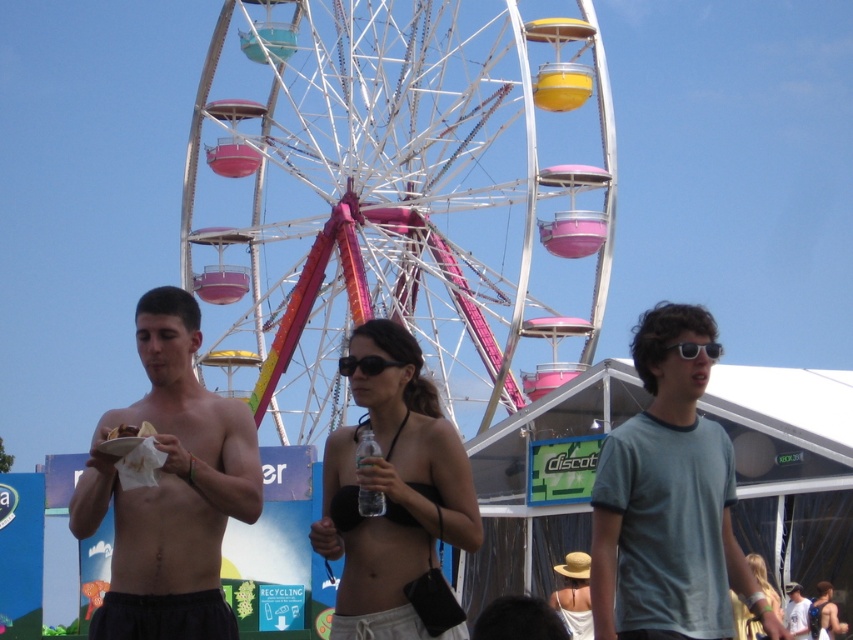
Does metallic ferris wheel at center appear under white cotton t-shirt at center?

No.

Is metallic ferris wheel at center smaller than white cotton t-shirt at center?

No.

Who is more forward, (334, 305) or (795, 596)?

Positioned in front is point (795, 596).

You are a GUI agent. You are given a task and a screenshot of the screen. Output one action in this format:
    pyautogui.click(x=<x>, y=<y>)
    Task: Click on the metallic ferris wheel at center
    
    Given the screenshot: What is the action you would take?
    pyautogui.click(x=399, y=192)

Does gray cotton t-shirt at center have a greater height compared to white cotton t-shirt at center?

Yes.

Can you confirm if gray cotton t-shirt at center is positioned below white cotton t-shirt at center?

No.

Which is in front, point (689, 561) or point (790, 612)?

Point (689, 561) is more forward.

The width and height of the screenshot is (853, 640). I want to click on gray cotton t-shirt at center, so click(668, 500).

Does clear plastic bottle at center have a lesser height compared to white cotton t-shirt at center?

Incorrect, clear plastic bottle at center's height does not fall short of white cotton t-shirt at center's.

Looking at this image, who is more forward, (367, 426) or (788, 600)?

Positioned in front is point (367, 426).

Find the location of a particular element. Image resolution: width=853 pixels, height=640 pixels. clear plastic bottle at center is located at coordinates (370, 502).

Identify the location of clear plastic bottle at center. (370, 502).